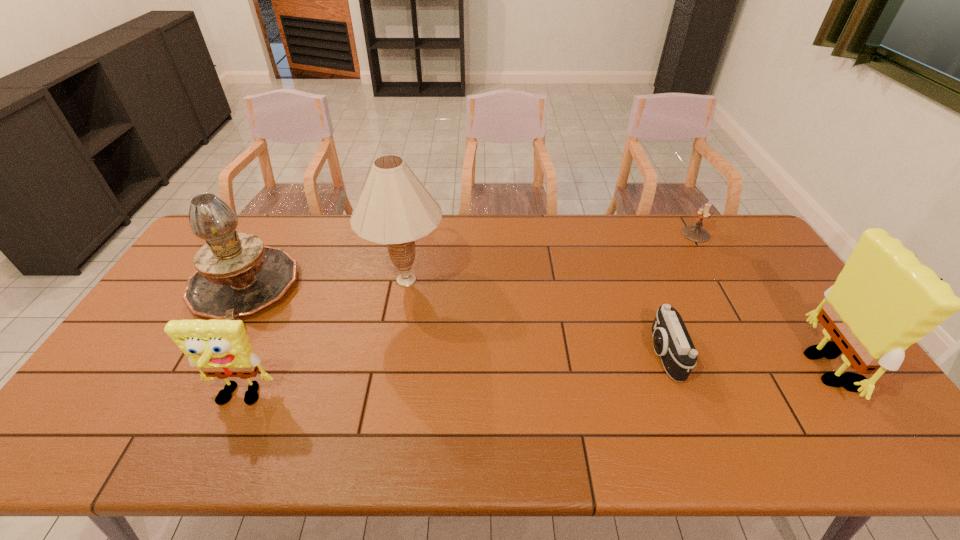
Identify the location of vacant space located 0.280m on the front of the farthest object. The width and height of the screenshot is (960, 540). (734, 300).

Locate an element on the screen. Image resolution: width=960 pixels, height=540 pixels. vacant position located 0.150m on the back of the third tallest object is located at coordinates coord(278,225).

What are the coordinates of `free location located on the back of the fourth object from right to left` in the screenshot? It's located at (418, 215).

Locate an element on the screen. The height and width of the screenshot is (540, 960). vacant space situated on the front lens of the shortest object is located at coordinates (548, 354).

This screenshot has height=540, width=960. In order to click on vacant space situated on the front lens of the shortest object in this screenshot , I will do `click(564, 354)`.

What are the coordinates of `vacant space located on the front lens of the shortest object` in the screenshot? It's located at (522, 354).

At what (x,y) coordinates should I click in order to perform the action: click on candle holder that is at the far edge. Please return your answer as a coordinate pair (x, y). Image resolution: width=960 pixels, height=540 pixels. Looking at the image, I should click on (694, 233).

What are the coordinates of `oil lamp at the far edge` in the screenshot? It's located at (237, 275).

Where is `lampshade that is at the far edge`? This screenshot has width=960, height=540. lampshade that is at the far edge is located at coordinates (394, 208).

Identify the location of camera located in the near edge section of the desktop. This screenshot has width=960, height=540. (671, 341).